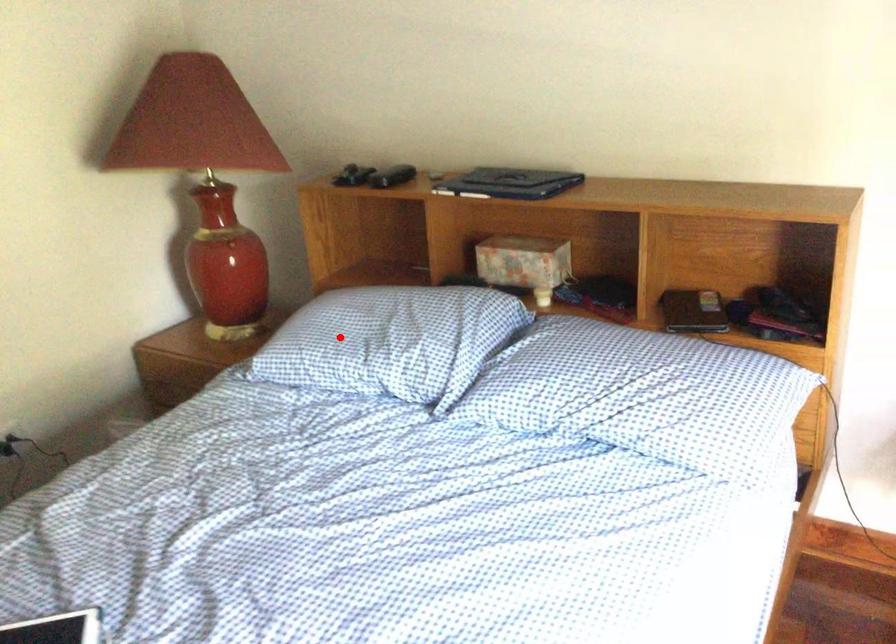
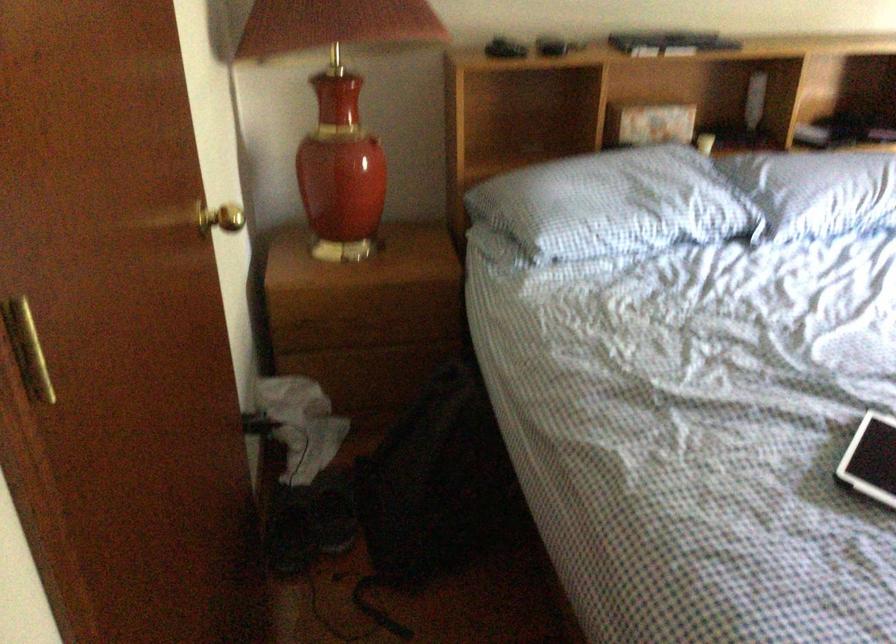
In the second image, find the point that corresponds to the highlighted location in the first image.

(613, 204)